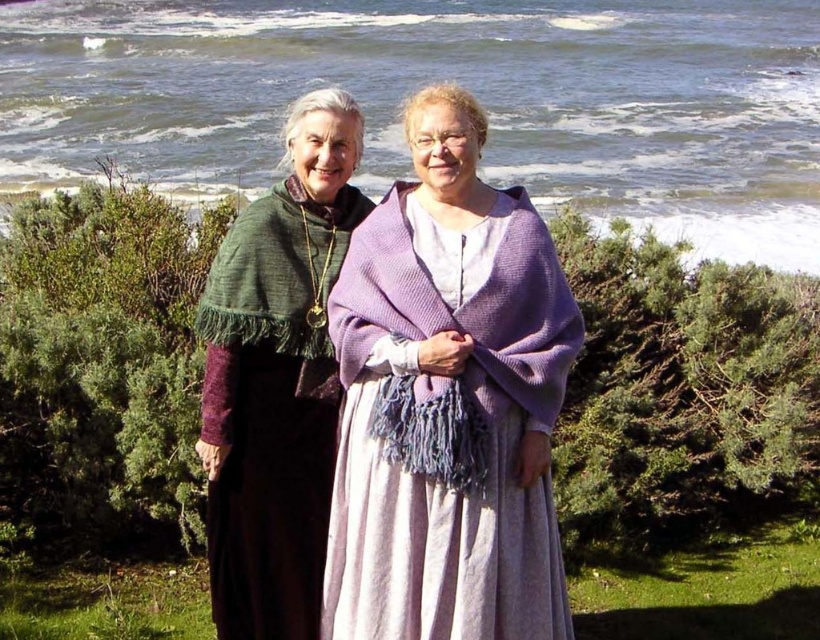
You are a tailor observing two knitted shawls in the image. The lavender knitted shawl at center and the green knitted shawl at left. Which shawl would require more fabric to make?

The lavender knitted shawl at center requires more fabric because it is bigger than the green knitted shawl at left.

In the scene shown: You are an observer looking at the two individuals in the coastal scene. Which shawl, the lavender knitted shawl at center or the green knitted shawl at left, is placed on top of the other?

The lavender knitted shawl at center is positioned over the green knitted shawl at left, meaning it is placed on top of the green one.